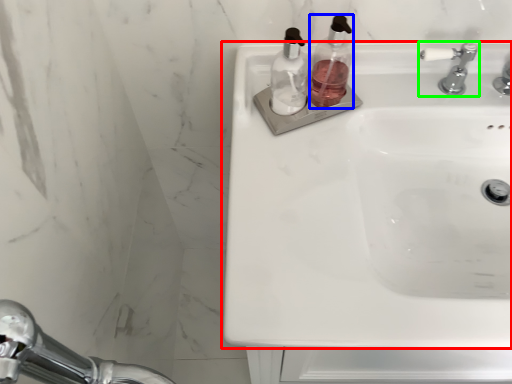
Question: Which object is the closest to the sink (highlighted by a red box)? Choose among these: soap dispenser (highlighted by a blue box) or tap (highlighted by a green box).

Choices:
 (A) soap dispenser
 (B) tap

Answer: (A)